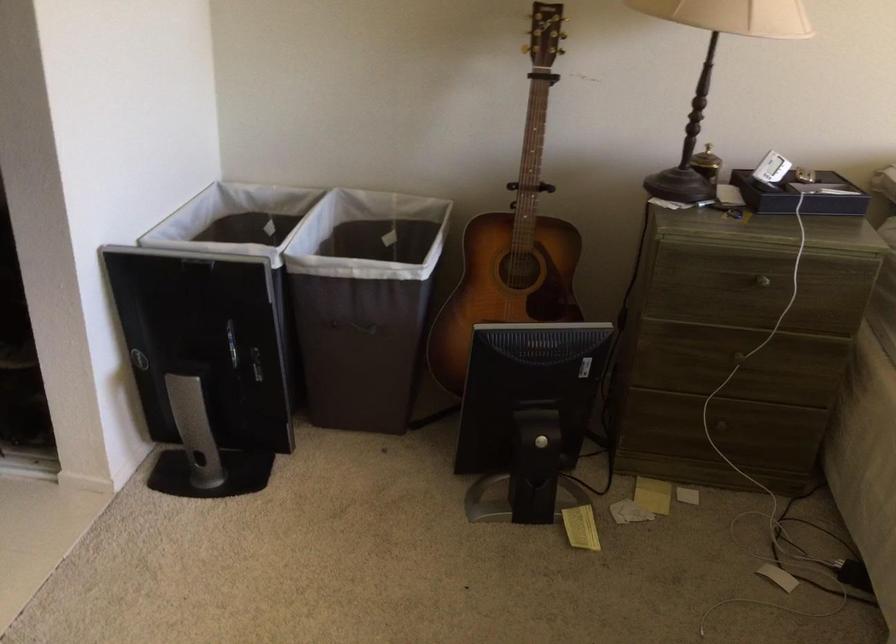
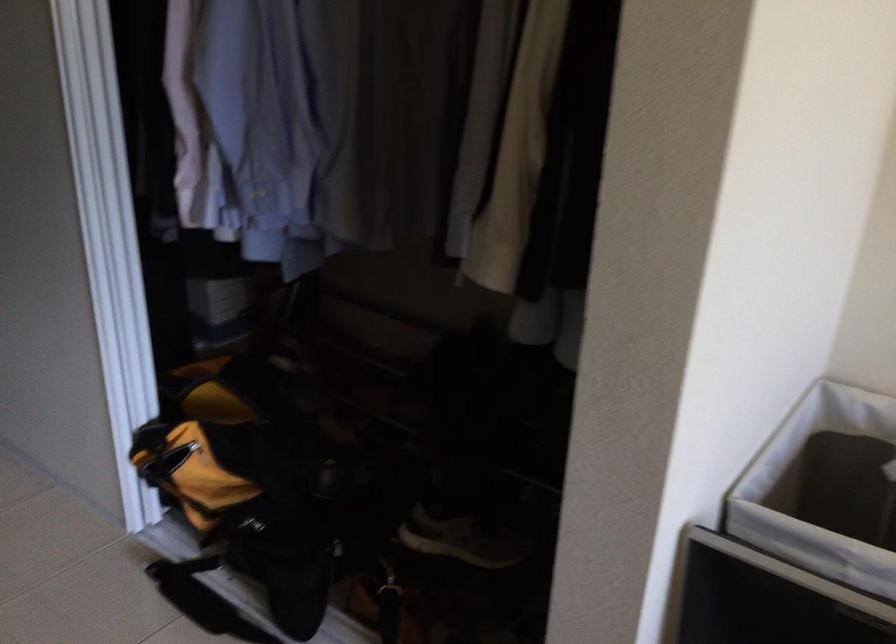
Question: The camera is either moving clockwise (left) or counter-clockwise (right) around the object. The first image is from the beginning of the video and the second image is from the end. Is the camera moving left or right when shooting the video?

Choices:
 (A) Left
 (B) Right

Answer: (B)